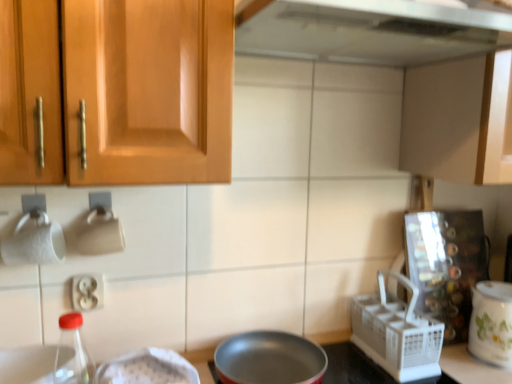
Describe the element at coordinates (88, 291) in the screenshot. I see `white plastic electrical outlet at lower left` at that location.

Find the location of a particular element. transparent glass bottle at lower left is located at coordinates (72, 353).

This screenshot has width=512, height=384. What do you see at coordinates (397, 333) in the screenshot? I see `white plastic basket at right` at bounding box center [397, 333].

In order to click on white ceramic pot at right in this screenshot , I will do `click(490, 323)`.

Identify the location of white plastic electrical outlet at lower left. (88, 291).

Is matte wood cabinet at upper right to the right of white ceramic pot at right from the viewer's perspective?

Indeed, matte wood cabinet at upper right is positioned on the right side of white ceramic pot at right.

From the image's perspective, which one is positioned higher, matte wood cabinet at upper right or white ceramic pot at right?

matte wood cabinet at upper right appears higher in the image.

Is the depth of matte wood cabinet at upper right less than that of white ceramic pot at right?

That is True.

Consider the image. Is matte wood cabinet at upper right facing towards white plastic electrical outlet at lower left?

No, matte wood cabinet at upper right does not turn towards white plastic electrical outlet at lower left.

Based on the photo, is matte wood cabinet at upper right in front of white plastic electrical outlet at lower left?

Yes, it is in front of white plastic electrical outlet at lower left.

Is point (502, 166) closer or farther from the camera than point (91, 292)?

Point (502, 166).

Which of these two, matte wood cabinet at upper right or white plastic electrical outlet at lower left, stands taller?

Standing taller between the two is matte wood cabinet at upper right.

Can you confirm if white plastic electrical outlet at lower left is taller than transparent glass bottle at lower left?

Incorrect, the height of white plastic electrical outlet at lower left is not larger of that of transparent glass bottle at lower left.

Looking at this image, would you say white plastic electrical outlet at lower left is outside transparent glass bottle at lower left?

Yes, white plastic electrical outlet at lower left is not within transparent glass bottle at lower left.

In the scene shown: From a real-world perspective, is white plastic electrical outlet at lower left physically located above or below transparent glass bottle at lower left?

In terms of real-world spatial position, white plastic electrical outlet at lower left is above transparent glass bottle at lower left.

Which object is positioned more to the left, white plastic electrical outlet at lower left or transparent glass bottle at lower left?

Positioned to the left is white plastic electrical outlet at lower left.

Can you tell me how much white ceramic pot at right and transparent glass bottle at lower left differ in facing direction?

white ceramic pot at right and transparent glass bottle at lower left are facing 1.44 degrees away from each other.

Which object is wider, white ceramic pot at right or transparent glass bottle at lower left?

white ceramic pot at right is wider.

Does white ceramic pot at right appear on the right side of transparent glass bottle at lower left?

Yes, white ceramic pot at right is to the right of transparent glass bottle at lower left.

Is white plastic electrical outlet at lower left looking in the opposite direction of white plastic basket at right?

No, white plastic electrical outlet at lower left is not facing the opposite direction of white plastic basket at right.

Is white plastic electrical outlet at lower left next to white plastic basket at right and touching it?

No, white plastic electrical outlet at lower left is not in contact with white plastic basket at right.

Measure the distance between white plastic electrical outlet at lower left and white plastic basket at right.

The distance of white plastic electrical outlet at lower left from white plastic basket at right is 30.89 inches.

From a real-world perspective, is white ceramic pot at right over white plastic electrical outlet at lower left?

No, from a real-world perspective, white ceramic pot at right is not over white plastic electrical outlet at lower left

Considering the sizes of objects white ceramic pot at right and white plastic electrical outlet at lower left in the image provided, who is taller, white ceramic pot at right or white plastic electrical outlet at lower left?

With more height is white ceramic pot at right.

Could you tell me if white ceramic pot at right is facing white plastic electrical outlet at lower left?

No, white ceramic pot at right is not turned towards white plastic electrical outlet at lower left.

From the image's perspective, is white ceramic pot at right beneath white plastic electrical outlet at lower left?

Correct, white ceramic pot at right appears lower than white plastic electrical outlet at lower left in the image.

In the scene shown: Is white plastic electrical outlet at lower left wider than white ceramic pot at right?

In fact, white plastic electrical outlet at lower left might be narrower than white ceramic pot at right.

Who is more distant, white plastic electrical outlet at lower left or white ceramic pot at right?

white ceramic pot at right is behind.

Is point (99, 285) in front of point (480, 348)?

Yes, it is.

Is white plastic electrical outlet at lower left positioned with its back to white ceramic pot at right?

No, white plastic electrical outlet at lower left's orientation is not away from white ceramic pot at right.

Locate an element on the screen. The image size is (512, 384). cabinetry in front of the white ceramic pot at right is located at coordinates (458, 119).

At what (x,y) coordinates should I click in order to perform the action: click on electric outlet below the matte wood cabinet at upper right (from a real-world perspective). Please return your answer as a coordinate pair (x, y). The width and height of the screenshot is (512, 384). Looking at the image, I should click on (88, 291).

When comparing their distances from white plastic electrical outlet at lower left, does white ceramic pot at right or white plastic basket at right seem closer?

white plastic basket at right is closer to white plastic electrical outlet at lower left.

Estimate the real-world distances between objects in this image. Which object is closer to white plastic electrical outlet at lower left, transparent glass bottle at lower left or white ceramic pot at right?

transparent glass bottle at lower left lies closer to white plastic electrical outlet at lower left than the other object.

Based on their spatial positions, is white plastic basket at right or white ceramic pot at right closer to transparent glass bottle at lower left?

Among the two, white plastic basket at right is located nearer to transparent glass bottle at lower left.

Based on their spatial positions, is transparent glass bottle at lower left or white plastic electrical outlet at lower left closer to white ceramic pot at right?

Among the two, white plastic electrical outlet at lower left is located nearer to white ceramic pot at right.

Looking at the image, which one is located closer to transparent glass bottle at lower left, matte wood cabinet at upper right or white plastic basket at right?

Result: Among the two, white plastic basket at right is located nearer to transparent glass bottle at lower left.

Considering their positions, is matte wood cabinet at upper right positioned closer to transparent glass bottle at lower left than white ceramic pot at right?

matte wood cabinet at upper right lies closer to transparent glass bottle at lower left than the other object.

From the image, which object appears to be nearer to white plastic basket at right, white ceramic pot at right or white plastic electrical outlet at lower left?

white ceramic pot at right is closer to white plastic basket at right.

Considering their positions, is transparent glass bottle at lower left positioned further to matte wood cabinet at upper right than white plastic basket at right?

transparent glass bottle at lower left.

Locate an element on the screen. This screenshot has width=512, height=384. basket between white plastic electrical outlet at lower left and matte wood cabinet at upper right from left to right is located at coordinates (397, 333).

This screenshot has width=512, height=384. What are the coordinates of `bottle located between white plastic electrical outlet at lower left and white plastic basket at right in the left-right direction` in the screenshot? It's located at (72, 353).

This screenshot has height=384, width=512. In order to click on kitchen appliance between white plastic electrical outlet at lower left and matte wood cabinet at upper right from left to right in this screenshot , I will do `click(490, 323)`.

The height and width of the screenshot is (384, 512). What are the coordinates of `bottle situated between white plastic electrical outlet at lower left and white ceramic pot at right from left to right` in the screenshot? It's located at (72, 353).